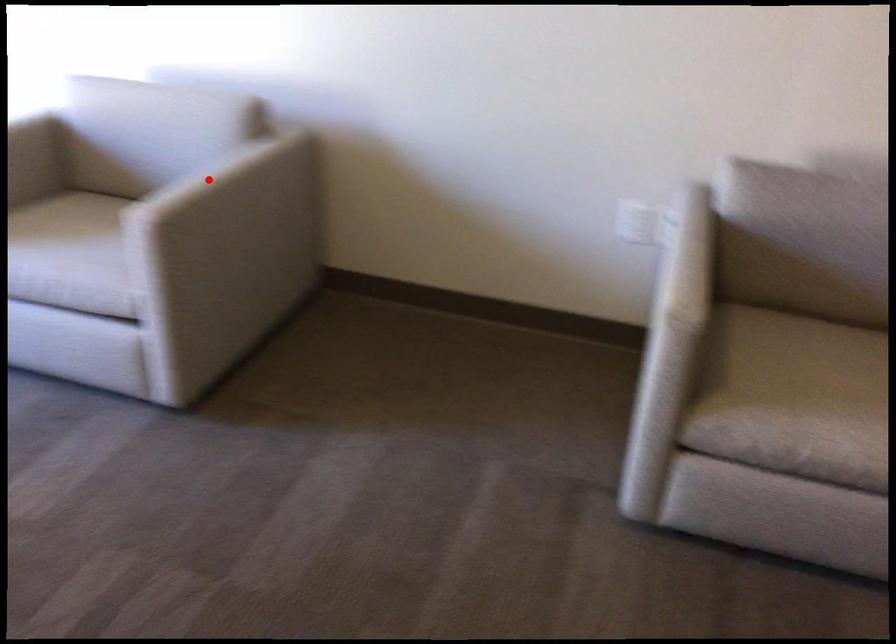
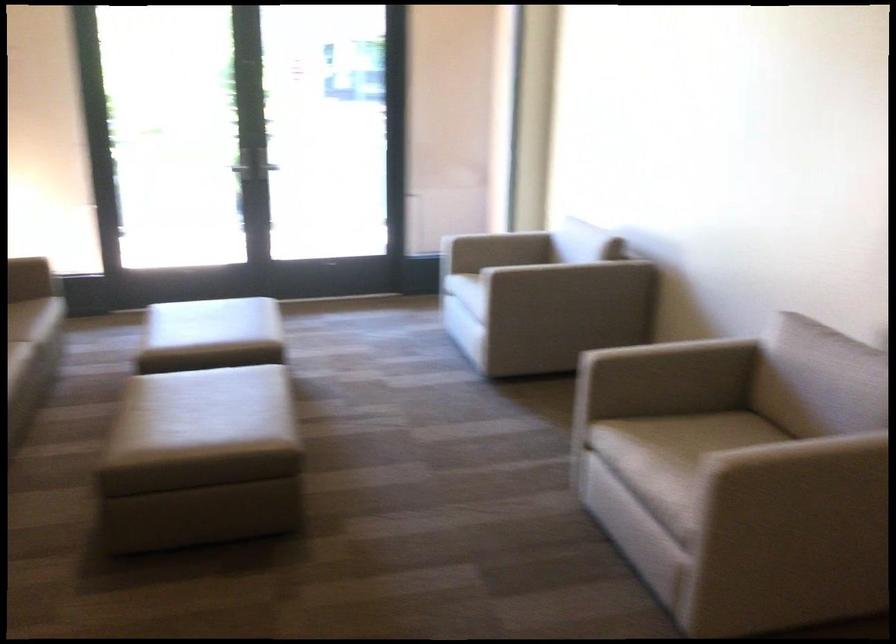
Locate, in the second image, the point that corresponds to the highlighted location in the first image.

(526, 261)